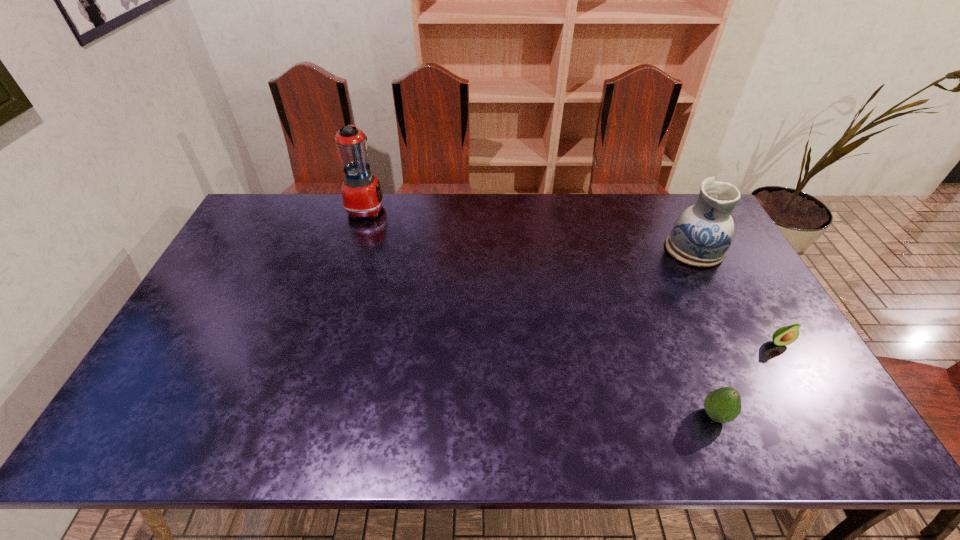
You are a GUI agent. You are given a task and a screenshot of the screen. Output one action in this format:
    pyautogui.click(x=<x>, y=<y>)
    Task: Click on the free space located 0.260m on the back of the second object from left to right
    The image size is (960, 540).
    Given the screenshot: What is the action you would take?
    pyautogui.click(x=676, y=319)

Where is `free spot located 0.270m on the cut side of the right avocado`? free spot located 0.270m on the cut side of the right avocado is located at coordinates (840, 448).

You are a GUI agent. You are given a task and a screenshot of the screen. Output one action in this format:
    pyautogui.click(x=<x>, y=<y>)
    Task: Click on the food processor located at the far edge
    The width and height of the screenshot is (960, 540).
    Given the screenshot: What is the action you would take?
    pyautogui.click(x=362, y=195)

The width and height of the screenshot is (960, 540). I want to click on pottery at the far edge, so click(701, 235).

Identify the location of object at the near edge. This screenshot has width=960, height=540. (722, 405).

At what (x,y) coordinates should I click in order to perform the action: click on pottery that is positioned at the right edge. Please return your answer as a coordinate pair (x, y). Looking at the image, I should click on (701, 235).

The height and width of the screenshot is (540, 960). Find the location of `avocado that is at the right edge`. avocado that is at the right edge is located at coordinates (786, 335).

Where is `object that is at the far right corner`? Image resolution: width=960 pixels, height=540 pixels. object that is at the far right corner is located at coordinates (701, 235).

Find the location of a particular element. This screenshot has width=960, height=540. free region at the far edge is located at coordinates (652, 234).

Identify the location of free space at the near edge of the desktop. The image size is (960, 540). (342, 441).